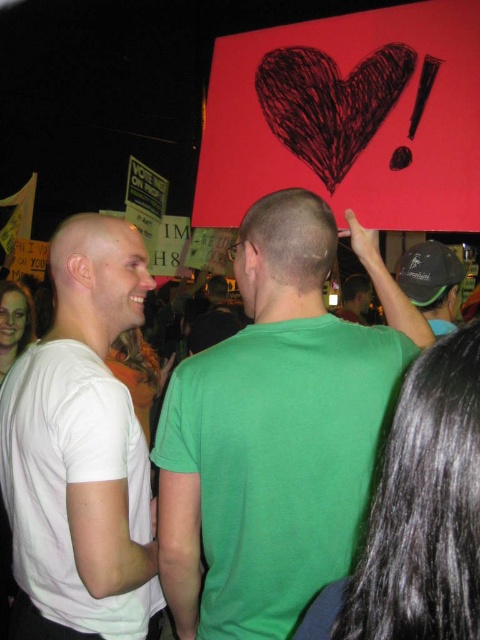
Does white matte t-shirt at center have a smaller size compared to bald head at center?

Incorrect, white matte t-shirt at center is not smaller in size than bald head at center.

From the picture: Does white matte t-shirt at center appear over bald head at center?

No, white matte t-shirt at center is not above bald head at center.

Find the location of `white matte t-shirt at center`. white matte t-shirt at center is located at coordinates (81, 445).

The height and width of the screenshot is (640, 480). In order to click on white matte t-shirt at center in this screenshot , I will do `click(81, 445)`.

In the scene shown: Who is positioned more to the right, green matte t-shirt at center or white matte bald head at left?

Positioned to the right is green matte t-shirt at center.

Between point (285, 259) and point (109, 237), which one is positioned behind?

Positioned behind is point (109, 237).

Between point (400, 324) and point (100, 257), which one is positioned in front?

Positioned in front is point (100, 257).

I want to click on green matte t-shirt at center, so click(276, 429).

Does bald head at center appear on the left side of white matte bald head at left?

No, bald head at center is not to the left of white matte bald head at left.

Does point (310, 228) lie behind point (69, 300)?

No.

This screenshot has height=640, width=480. In order to click on bald head at center in this screenshot , I will do `click(285, 256)`.